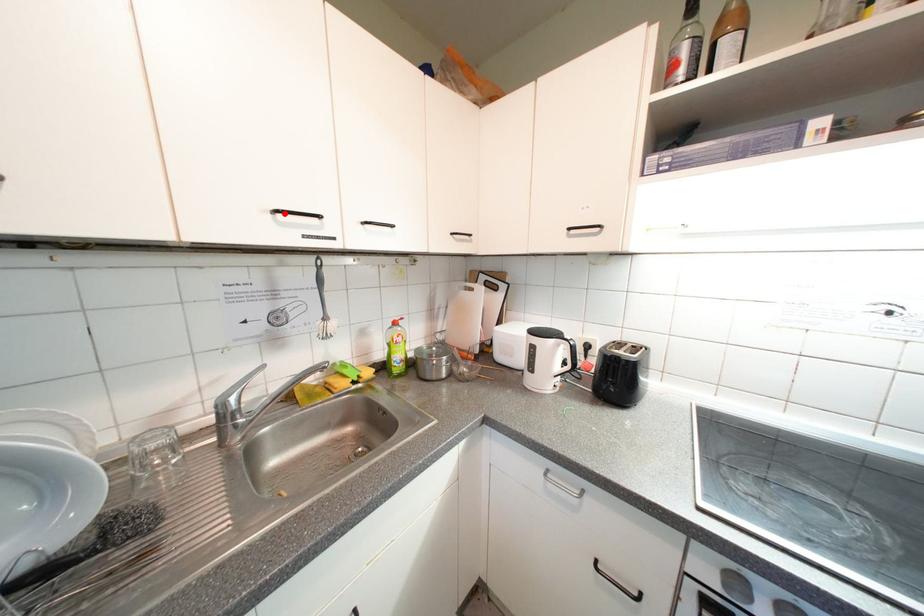
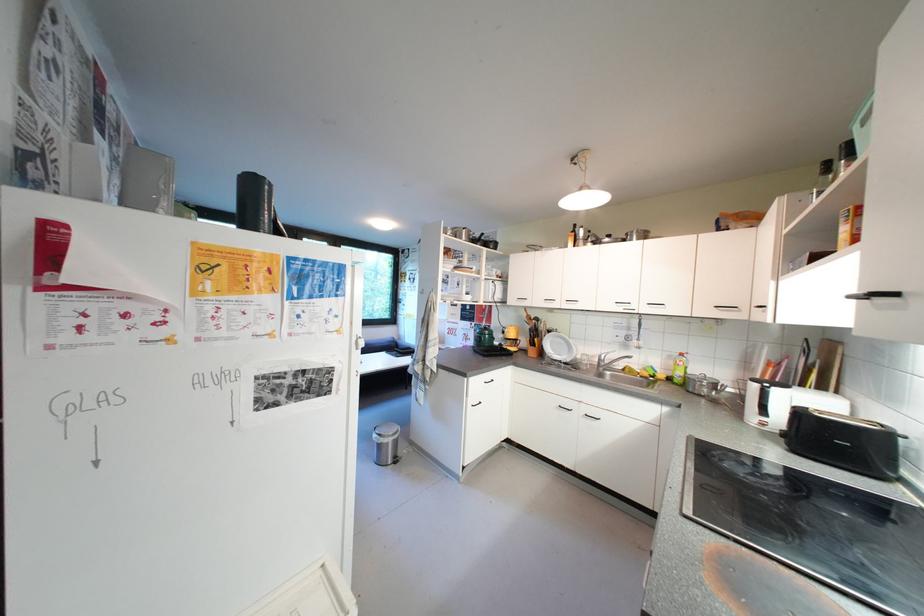
Locate, in the second image, the point that corresponds to the highlighted location in the first image.

(624, 305)